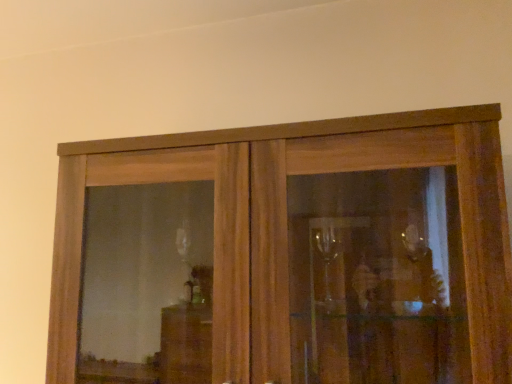
Describe the element at coordinates (248, 218) in the screenshot. The width and height of the screenshot is (512, 384). I see `brown wooden cupboard at center` at that location.

Measure the distance between brown wooden cupboard at center and camera.

They are 30.25 inches apart.

In order to face brown wooden cupboard at center, should I rotate leftwards or rightwards?

You should rotate right by 2.195 degrees.

Image resolution: width=512 pixels, height=384 pixels. What are the coordinates of `brown wooden cupboard at center` in the screenshot? It's located at (248, 218).

Locate an element on the screen. This screenshot has height=384, width=512. brown wooden cupboard at center is located at coordinates (248, 218).